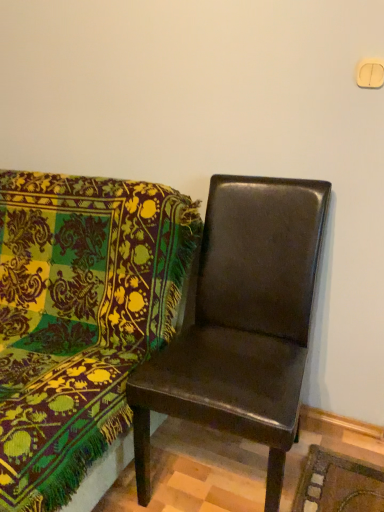
Question: Is point (140, 476) closer or farther from the camera than point (21, 358)?

Choices:
 (A) farther
 (B) closer

Answer: (A)

Question: In terms of width, does leather-like brown chair at center, marked as the 2th chair in a left-to-right arrangement, look wider or thinner when compared to leather-like dark brown chair at right, the second chair positioned from the right?

Choices:
 (A) thin
 (B) wide

Answer: (A)

Question: Relative to leather-like dark brown chair at right, the second chair positioned from the right, is leather-like brown chair at center, marked as the 2th chair in a left-to-right arrangement, in front or behind?

Choices:
 (A) front
 (B) behind

Answer: (B)

Question: Based on their positions, is leather-like dark brown chair at right, which is the first chair from left to right, located to the left or right of leather-like brown chair at center, which ranks as the first chair in right-to-left order?

Choices:
 (A) right
 (B) left

Answer: (B)

Question: Considering their positions, is leather-like dark brown chair at right, the second chair positioned from the right, located in front of or behind leather-like brown chair at center, which ranks as the first chair in right-to-left order?

Choices:
 (A) behind
 (B) front

Answer: (B)

Question: Is leather-like dark brown chair at right, the second chair positioned from the right, spatially inside leather-like brown chair at center, marked as the 2th chair in a left-to-right arrangement, or outside of it?

Choices:
 (A) inside
 (B) outside

Answer: (B)

Question: Looking at their shapes, would you say leather-like dark brown chair at right, the second chair positioned from the right, is wider or thinner than leather-like brown chair at center, marked as the 2th chair in a left-to-right arrangement?

Choices:
 (A) wide
 (B) thin

Answer: (A)